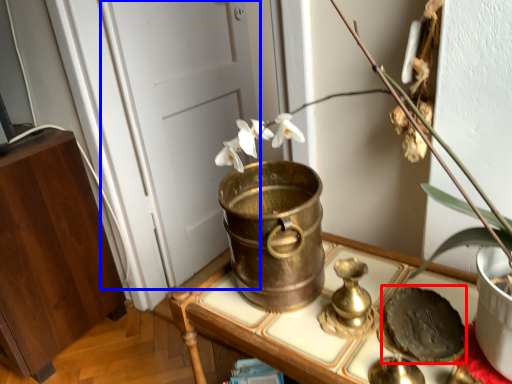
Question: Which of the following is the closest to the observer, food (highlighted by a red box) or door (highlighted by a blue box)?

Choices:
 (A) food
 (B) door

Answer: (A)